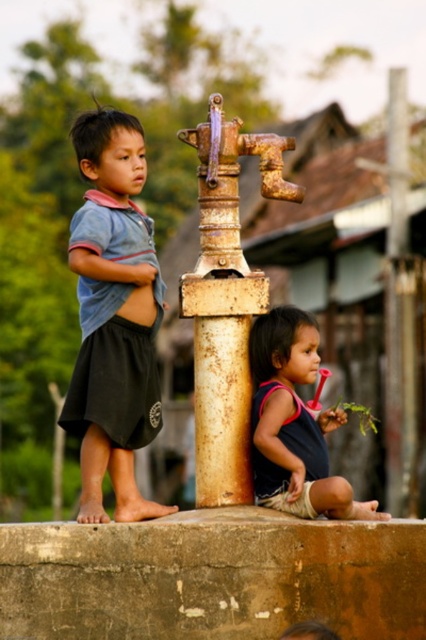
Question: Which point is closer to the camera?

Choices:
 (A) rusty metal pole at center
 (B) dark blue fabric shirt at lower right
 (C) blue cotton shirt at left

Answer: (C)

Question: Does blue cotton shirt at left have a greater width compared to rusty metal pole at center?

Choices:
 (A) yes
 (B) no

Answer: (A)

Question: Which point is farther to the camera?

Choices:
 (A) dark blue fabric shirt at lower right
 (B) blue cotton shirt at left
 (C) rusty metal pole at center

Answer: (C)

Question: Where is blue cotton shirt at left located in relation to rusty metal pole at center in the image?

Choices:
 (A) right
 (B) left

Answer: (B)

Question: Among these objects, which one is farthest from the camera?

Choices:
 (A) dark blue fabric shirt at lower right
 (B) rusty metal pole at center

Answer: (B)

Question: Observing the image, what is the correct spatial positioning of blue cotton shirt at left in reference to rusty metal pole at center?

Choices:
 (A) left
 (B) right

Answer: (A)